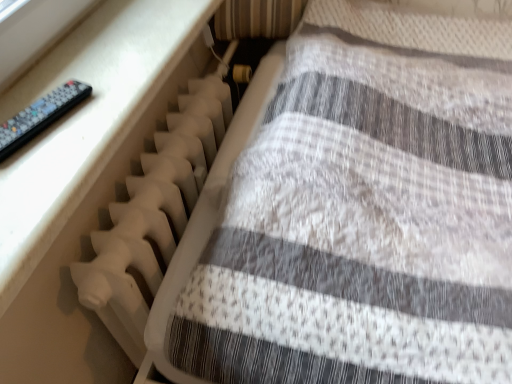
Question: Does white plastic radiator at left have a larger size compared to white plastic radiator at lower left?

Choices:
 (A) yes
 (B) no

Answer: (B)

Question: From a real-world perspective, is white plastic radiator at left under white plastic radiator at lower left?

Choices:
 (A) yes
 (B) no

Answer: (A)

Question: Considering the relative sizes of white plastic radiator at left and white plastic radiator at lower left in the image provided, is white plastic radiator at left shorter than white plastic radiator at lower left?

Choices:
 (A) no
 (B) yes

Answer: (B)

Question: Is white plastic radiator at left oriented away from white plastic radiator at lower left?

Choices:
 (A) yes
 (B) no

Answer: (B)

Question: Are white plastic radiator at left and white plastic radiator at lower left far apart?

Choices:
 (A) no
 (B) yes

Answer: (A)

Question: Would you say white plastic radiator at left is outside white plastic radiator at lower left?

Choices:
 (A) yes
 (B) no

Answer: (A)

Question: Does black plastic remote at left touch white plastic radiator at left?

Choices:
 (A) no
 (B) yes

Answer: (A)

Question: Is black plastic remote at left oriented towards white plastic radiator at left?

Choices:
 (A) yes
 (B) no

Answer: (B)

Question: Is black plastic remote at left looking in the opposite direction of white plastic radiator at left?

Choices:
 (A) no
 (B) yes

Answer: (A)

Question: From the image's perspective, is black plastic remote at left on white plastic radiator at left?

Choices:
 (A) yes
 (B) no

Answer: (A)

Question: Considering the relative sizes of black plastic remote at left and white plastic radiator at left in the image provided, is black plastic remote at left taller than white plastic radiator at left?

Choices:
 (A) no
 (B) yes

Answer: (A)

Question: Is black plastic remote at left to the right of white plastic radiator at left from the viewer's perspective?

Choices:
 (A) no
 (B) yes

Answer: (A)

Question: From the image's perspective, does black plastic remote at left appear lower than white plastic radiator at lower left?

Choices:
 (A) no
 (B) yes

Answer: (A)